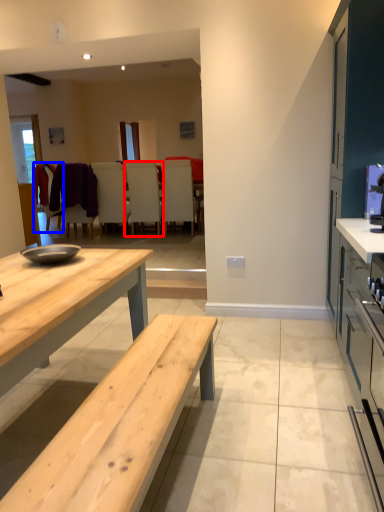
Question: Which point is further to the camera, chair (highlighted by a red box) or chair (highlighted by a blue box)?

Choices:
 (A) chair
 (B) chair

Answer: (B)